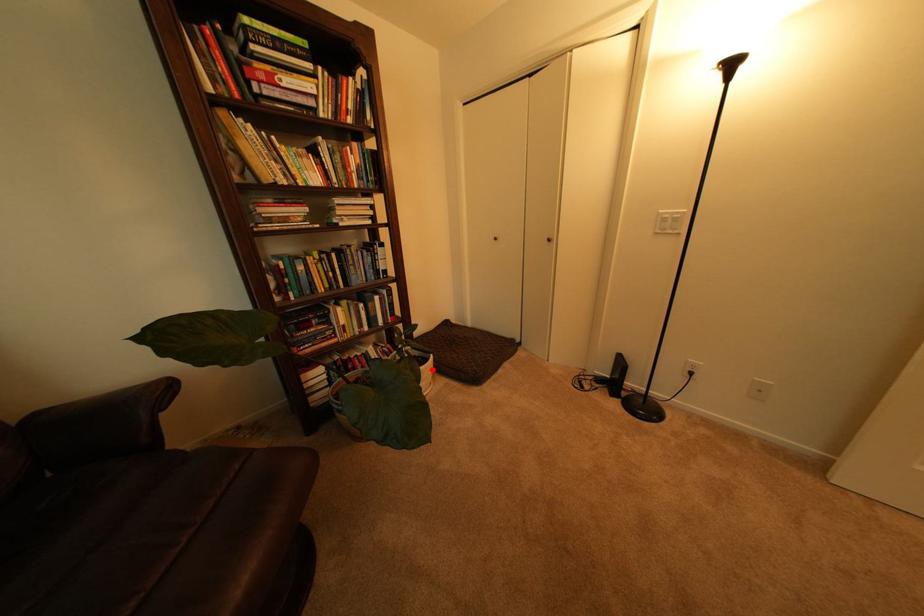
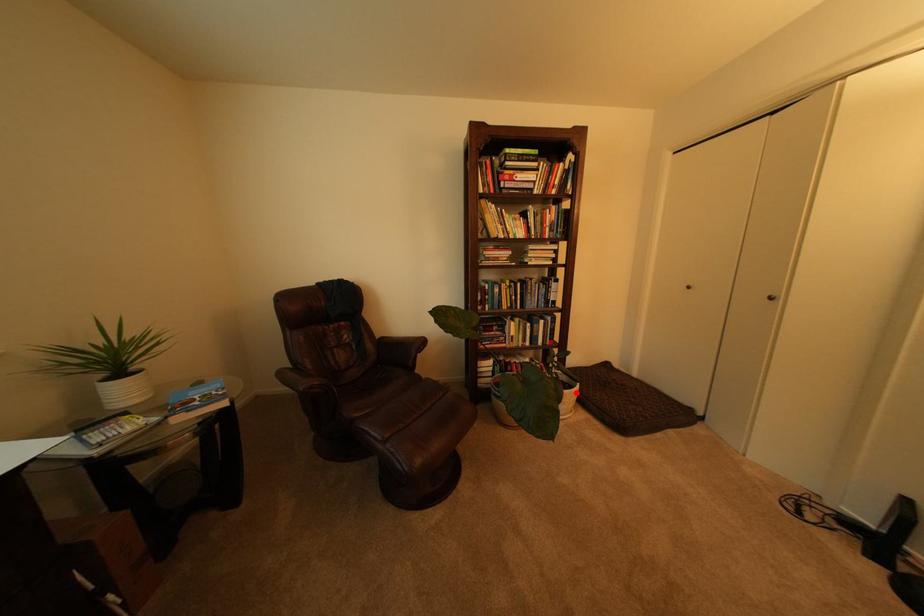
I am providing you with two images of the same scene from different viewpoints. A red point is marked on the first image and another point is marked on the second image. Is the marked point in image1 the same physical position as the marked point in image2?

Yes